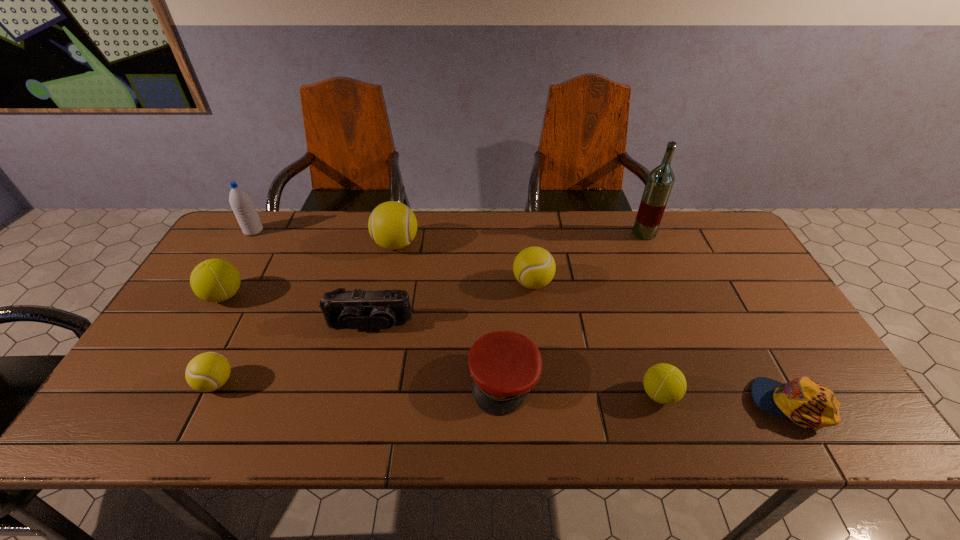
Choose which tennis ball is the third nearest neighbor to the bigger green tennis ball. Please provide its 2D coordinates. Your answer should be formatted as a tuple, i.e. [(x, y)], where the tuple contains the x and y coordinates of a point satisfying the conditions above.

[(534, 267)]

Locate which tennis ball is the second closest to the left cap. Please provide its 2D coordinates. Your answer should be formatted as a tuple, i.e. [(x, y)], where the tuple contains the x and y coordinates of a point satisfying the conditions above.

[(664, 383)]

I want to click on yellow tennis ball object that ranks as the second closest to the eighth shortest object, so click(x=209, y=371).

Identify which yellow tennis ball is located as the second nearest to the smallest yellow tennis ball. Please provide its 2D coordinates. Your answer should be formatted as a tuple, i.e. [(x, y)], where the tuple contains the x and y coordinates of a point satisfying the conditions above.

[(534, 267)]

You are a GUI agent. You are given a task and a screenshot of the screen. Output one action in this format:
    pyautogui.click(x=<x>, y=<y>)
    Task: Click on the vacant space that satisfies the following two spatial constraints: 1. on the front side of the second biggest yellow tennis ball; 2. on the left side of the right green tennis ball
    The height and width of the screenshot is (540, 960).
    Given the screenshot: What is the action you would take?
    pyautogui.click(x=546, y=394)